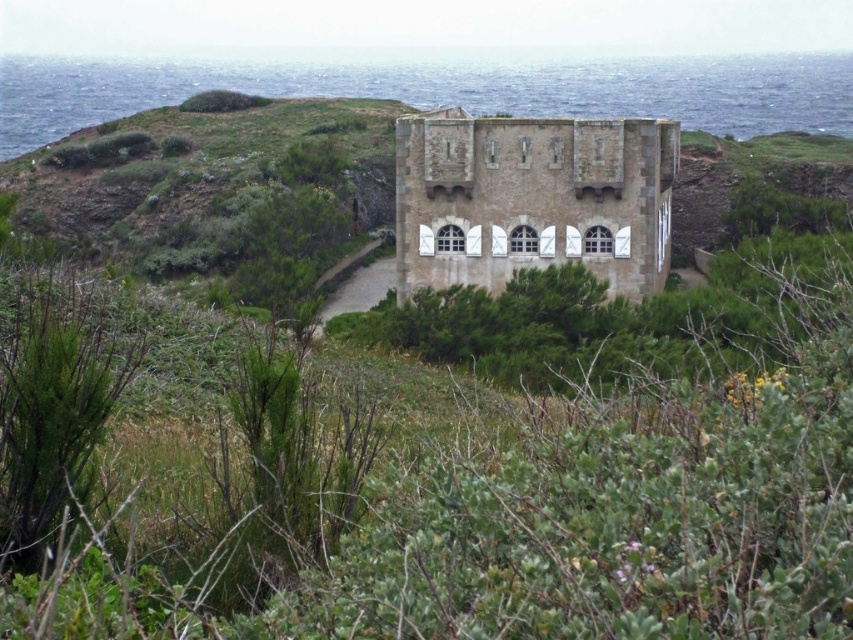
Question: Which of the following is the farthest from the observer?

Choices:
 (A) brown stone castle at center
 (B) blue water at center

Answer: (B)

Question: Does blue water at center appear over brown stone castle at center?

Choices:
 (A) no
 (B) yes

Answer: (B)

Question: Can you confirm if blue water at center is bigger than brown stone castle at center?

Choices:
 (A) no
 (B) yes

Answer: (B)

Question: Which point is farther to the camera?

Choices:
 (A) blue water at center
 (B) brown stone castle at center

Answer: (A)

Question: Which object appears closest to the camera in this image?

Choices:
 (A) brown stone castle at center
 (B) blue water at center

Answer: (A)

Question: Is blue water at center further to camera compared to brown stone castle at center?

Choices:
 (A) no
 (B) yes

Answer: (B)